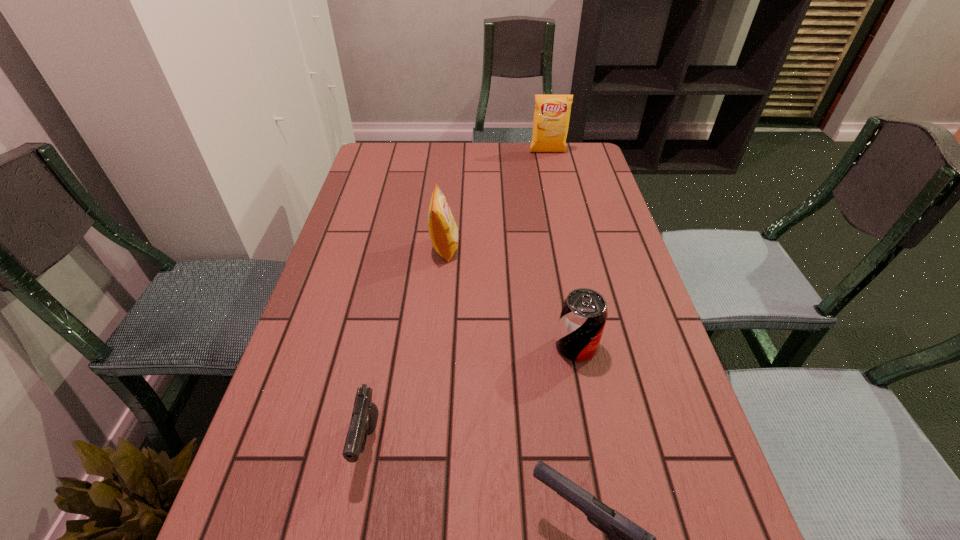
I want to click on the third closest object relative to the farthest object, so click(364, 417).

The width and height of the screenshot is (960, 540). I want to click on object that ranks as the second closest to the soda can, so (443, 231).

Identify the location of free space that satisfies the following two spatial constraints: 1. on the front-facing side of the nearer crisp (potato chip); 2. at the barrel of the shortest object. This screenshot has width=960, height=540. (428, 442).